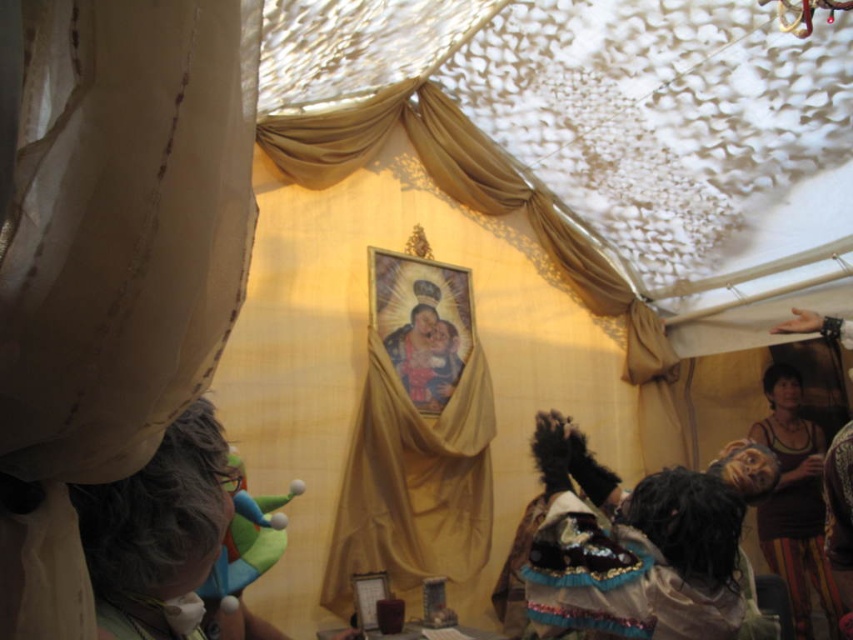
You are planning to hang a new decorative banner in this ceremonial tent. The banner requires a space that is wider than the translucent beige curtain at left. Which object among the gold satin curtain at center can you use as a reference to ensure the banner has enough space?

The gold satin curtain at center occupies more space than the translucent beige curtain at left, so you can use the gold satin curtain at center as a reference to ensure the banner has enough space.